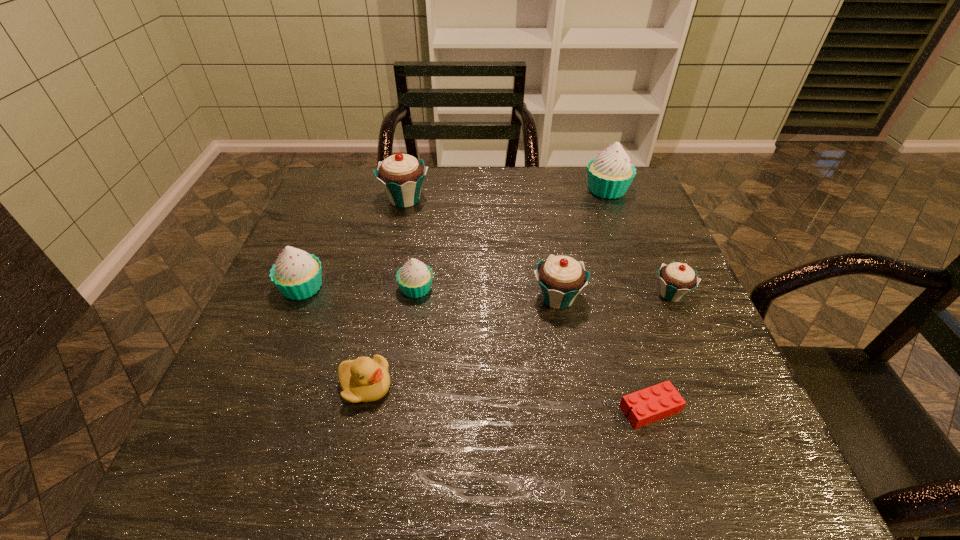
Identify the location of vacant point that satisfies the following two spatial constraints: 1. on the beak of the Lego; 2. on the left side of the duckling. This screenshot has width=960, height=540. (361, 409).

Find the location of a particular element. vacant space that satisfies the following two spatial constraints: 1. on the back side of the shortest object; 2. on the left side of the smallest teal cupcake is located at coordinates (615, 294).